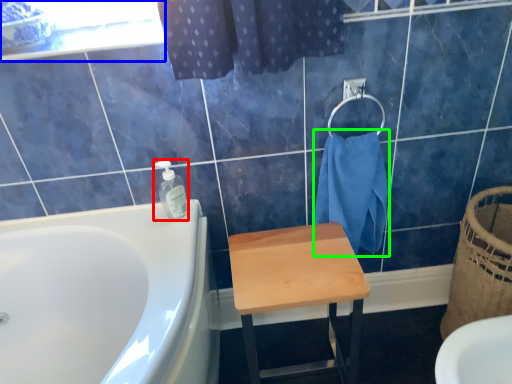
Question: Which object is positioned closest to soap dispenser (highlighted by a red box)? Select from window screen (highlighted by a blue box) and bath towel (highlighted by a green box).

Choices:
 (A) window screen
 (B) bath towel

Answer: (A)